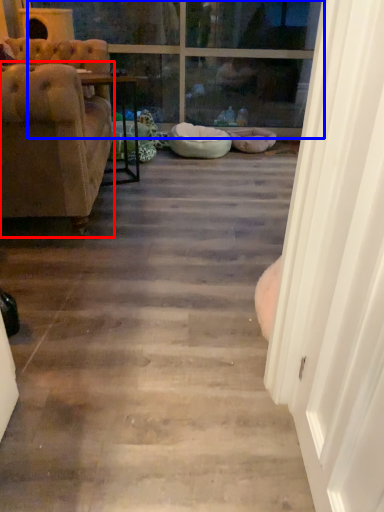
Question: Which point is further to the camera, chair (highlighted by a red box) or window (highlighted by a blue box)?

Choices:
 (A) chair
 (B) window

Answer: (B)